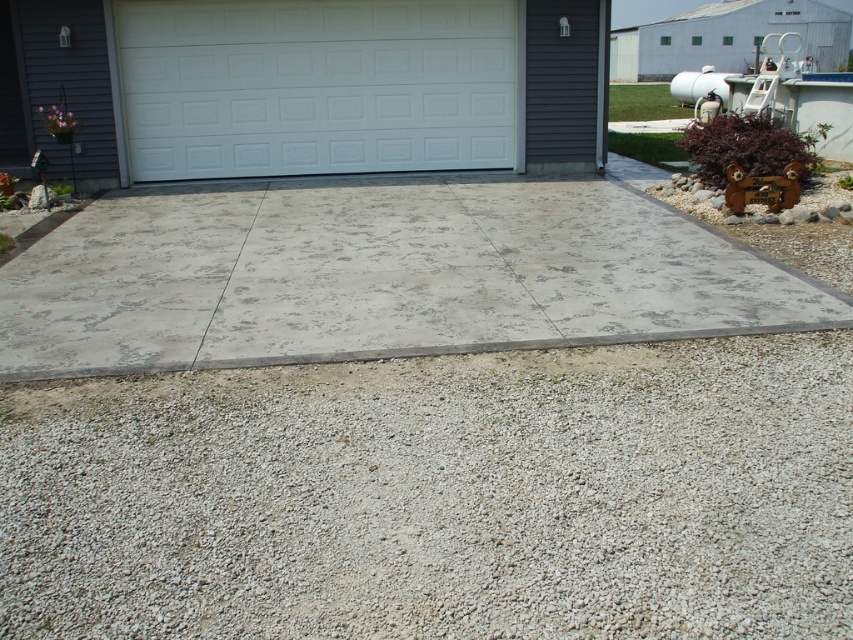
Who is lower down, gray gravel at lower center or gray concrete pavement at center?

gray gravel at lower center

Can you confirm if gray gravel at lower center is positioned above gray concrete pavement at center?

No.

You are a GUI agent. You are given a task and a screenshot of the screen. Output one action in this format:
    pyautogui.click(x=<x>, y=<y>)
    Task: Click on the gray gravel at lower center
    The width and height of the screenshot is (853, 640).
    Given the screenshot: What is the action you would take?
    pyautogui.click(x=439, y=497)

Find the location of a particular element. The width and height of the screenshot is (853, 640). gray gravel at lower center is located at coordinates pos(439,497).

Can you confirm if gray gravel at lower center is positioned to the left of white painted wood garage door at center?

In fact, gray gravel at lower center is to the right of white painted wood garage door at center.

In the scene shown: Does gray gravel at lower center appear over white painted wood garage door at center?

No, gray gravel at lower center is not above white painted wood garage door at center.

The width and height of the screenshot is (853, 640). Find the location of `gray gravel at lower center`. gray gravel at lower center is located at coordinates (439, 497).

Does gray concrete pavement at center appear under white painted wood garage door at center?

Indeed, gray concrete pavement at center is positioned under white painted wood garage door at center.

Between gray concrete pavement at center and white painted wood garage door at center, which one appears on the left side from the viewer's perspective?

From the viewer's perspective, white painted wood garage door at center appears more on the left side.

Describe the element at coordinates (380, 276) in the screenshot. I see `gray concrete pavement at center` at that location.

This screenshot has width=853, height=640. What are the coordinates of `gray concrete pavement at center` in the screenshot? It's located at (380, 276).